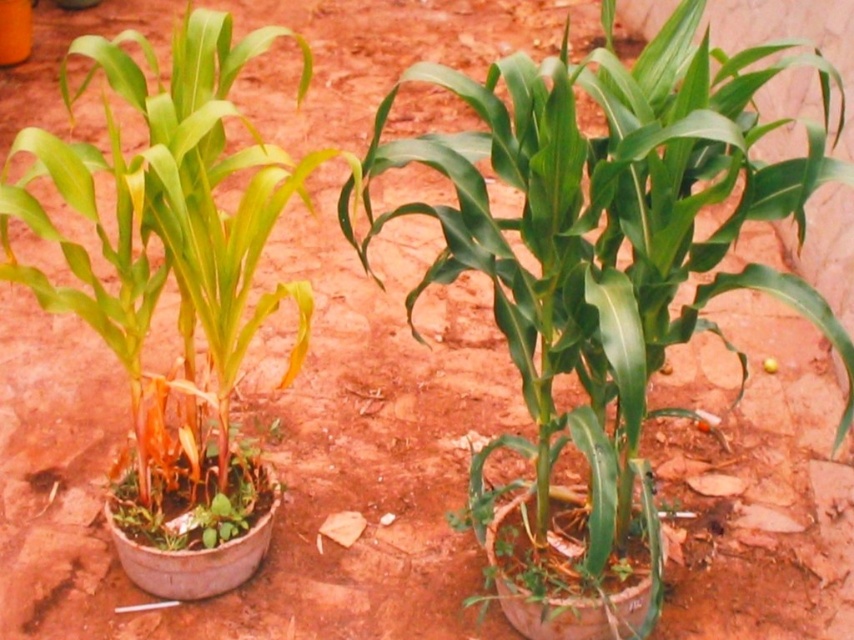
Question: Does green leafy plant at center lie behind green matte plant at center?

Choices:
 (A) yes
 (B) no

Answer: (B)

Question: Which point is farther to the camera?

Choices:
 (A) green matte plant at center
 (B) green leafy plant at center

Answer: (A)

Question: Is green leafy plant at center above green matte plant at center?

Choices:
 (A) no
 (B) yes

Answer: (A)

Question: Does green leafy plant at center come in front of green matte plant at center?

Choices:
 (A) no
 (B) yes

Answer: (B)

Question: Which of the following is the closest to the observer?

Choices:
 (A) green matte plant at center
 (B) green leafy plant at center

Answer: (B)